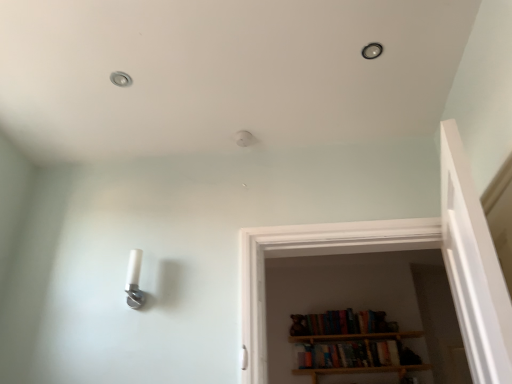
Question: Is white plastic light fixture at lower left inside or outside of metallic ceiling light at upper left?

Choices:
 (A) inside
 (B) outside

Answer: (B)

Question: In the image, is white plastic light fixture at lower left on the left side or the right side of metallic ceiling light at upper left?

Choices:
 (A) left
 (B) right

Answer: (B)

Question: Which object is positioned closest to the metallic ceiling light at upper left?

Choices:
 (A) matte black light fixture at upper center
 (B) white plastic light fixture at lower left
 (C) wooden bookshelf at center

Answer: (B)

Question: Which object is the farthest from the matte black light fixture at upper center?

Choices:
 (A) metallic ceiling light at upper left
 (B) wooden bookshelf at center
 (C) white plastic light fixture at lower left

Answer: (B)